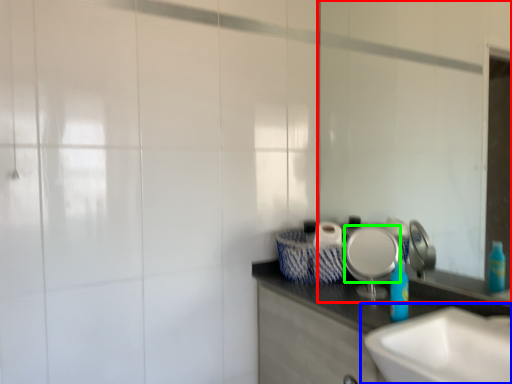
Question: Which is farther away from mirror (highlighted by a red box)? sink (highlighted by a blue box) or plate (highlighted by a green box)?

Choices:
 (A) sink
 (B) plate

Answer: (A)